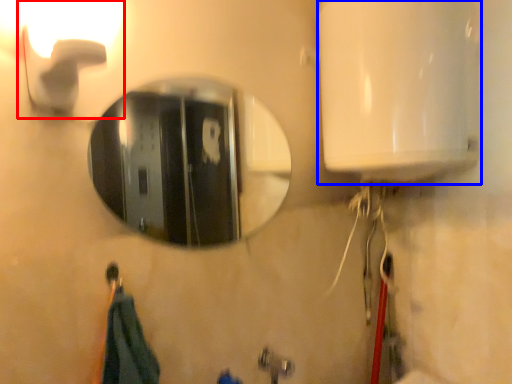
Question: Among these objects, which one is farthest to the camera, light fixture (highlighted by a red box) or appliance (highlighted by a blue box)?

Choices:
 (A) light fixture
 (B) appliance

Answer: (B)